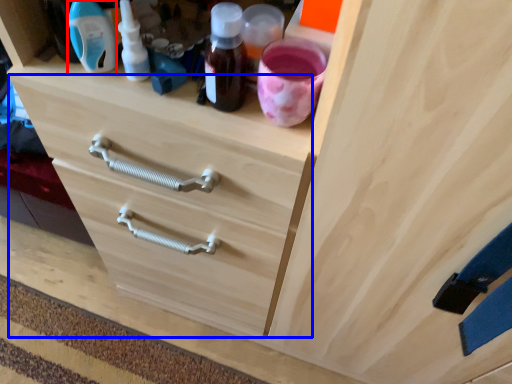
Question: Which object appears farthest to the camera in this image, bottle (highlighted by a red box) or drawer (highlighted by a blue box)?

Choices:
 (A) bottle
 (B) drawer

Answer: (B)